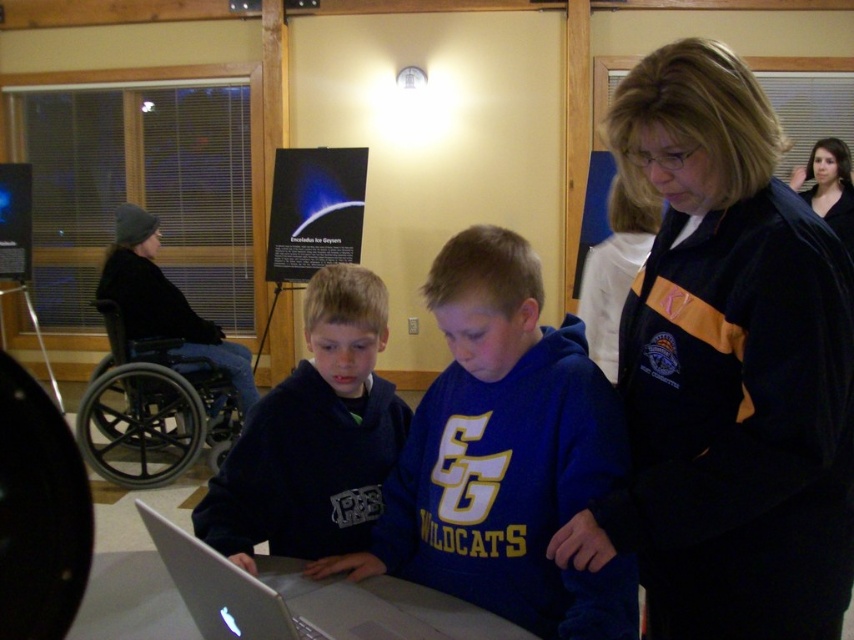
Can you confirm if black fleece jacket at upper right is shorter than black plastic wheelchair at left?

In fact, black fleece jacket at upper right may be taller than black plastic wheelchair at left.

Between black fleece jacket at upper right and black plastic wheelchair at left, which one is positioned higher?

Positioned higher is black fleece jacket at upper right.

Describe the element at coordinates (730, 365) in the screenshot. I see `black fleece jacket at upper right` at that location.

At what (x,y) coordinates should I click in order to perform the action: click on black fleece jacket at upper right. Please return your answer as a coordinate pair (x, y). Looking at the image, I should click on (730, 365).

Describe the element at coordinates (379, 608) in the screenshot. I see `silver metallic table at lower center` at that location.

Which is more to the right, silver metallic table at lower center or black fleece jacket at left?

From the viewer's perspective, silver metallic table at lower center appears more on the right side.

This screenshot has height=640, width=854. What do you see at coordinates (379, 608) in the screenshot?
I see `silver metallic table at lower center` at bounding box center [379, 608].

This screenshot has width=854, height=640. What are the coordinates of `silver metallic table at lower center` in the screenshot? It's located at (379, 608).

Is silver metallic table at lower center smaller than black plastic wheelchair at left?

Yes.

Can you confirm if silver metallic table at lower center is positioned to the right of black plastic wheelchair at left?

Yes, silver metallic table at lower center is to the right of black plastic wheelchair at left.

Find the location of a particular element. Image resolution: width=854 pixels, height=640 pixels. silver metallic table at lower center is located at coordinates (379, 608).